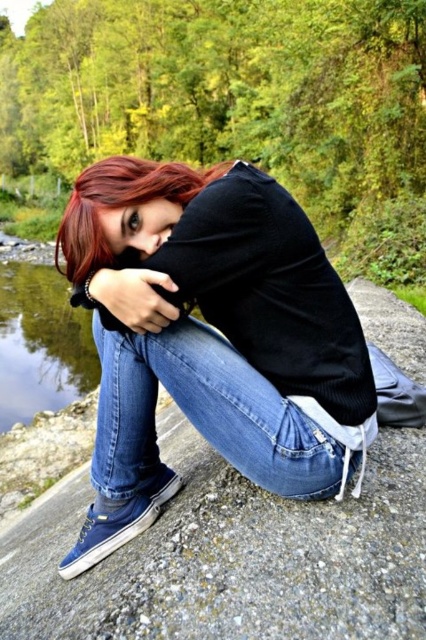
Does point (328, 452) lie in front of point (176, 289)?

No, (328, 452) is behind (176, 289).

Which is behind, point (267, 227) or point (89, 284)?

The point (267, 227) is more distant.

Who is more distant from viewer, (154, 461) or (123, 280)?

Point (154, 461)

In order to click on blue denim jeans at center in this screenshot , I will do (x=218, y=337).

Is denim jeans at lower center taller than clear water at lower left?

In fact, denim jeans at lower center may be shorter than clear water at lower left.

Does denim jeans at lower center have a smaller size compared to clear water at lower left?

Yes, denim jeans at lower center is smaller than clear water at lower left.

Locate an element on the screen. The image size is (426, 640). denim jeans at lower center is located at coordinates (203, 413).

Looking at this image, does denim jeans at lower center appear on the left side of matte black hand at center?

Incorrect, denim jeans at lower center is not on the left side of matte black hand at center.

Does denim jeans at lower center have a smaller size compared to matte black hand at center?

No.

Where is `denim jeans at lower center`? The height and width of the screenshot is (640, 426). denim jeans at lower center is located at coordinates (203, 413).

The width and height of the screenshot is (426, 640). In order to click on denim jeans at lower center in this screenshot , I will do `click(203, 413)`.